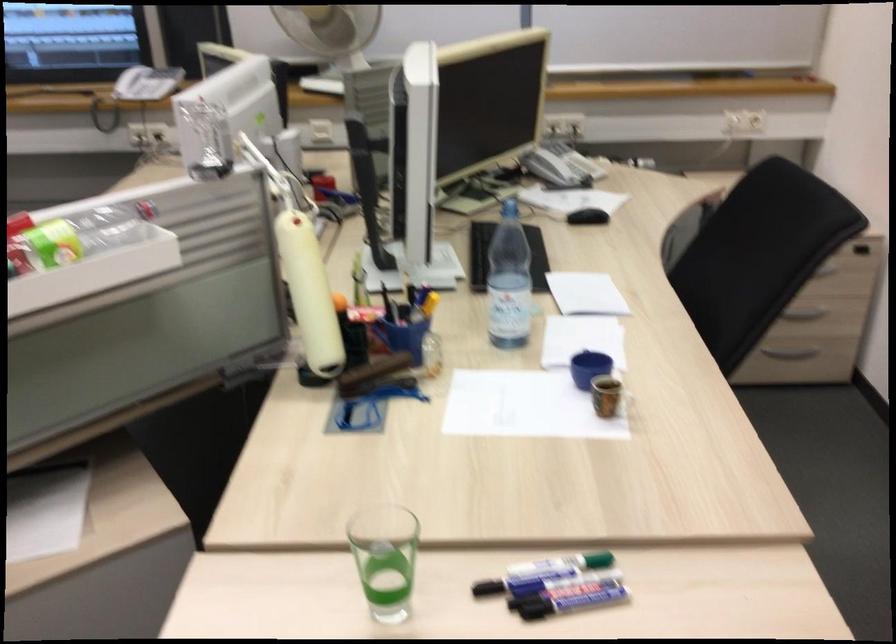
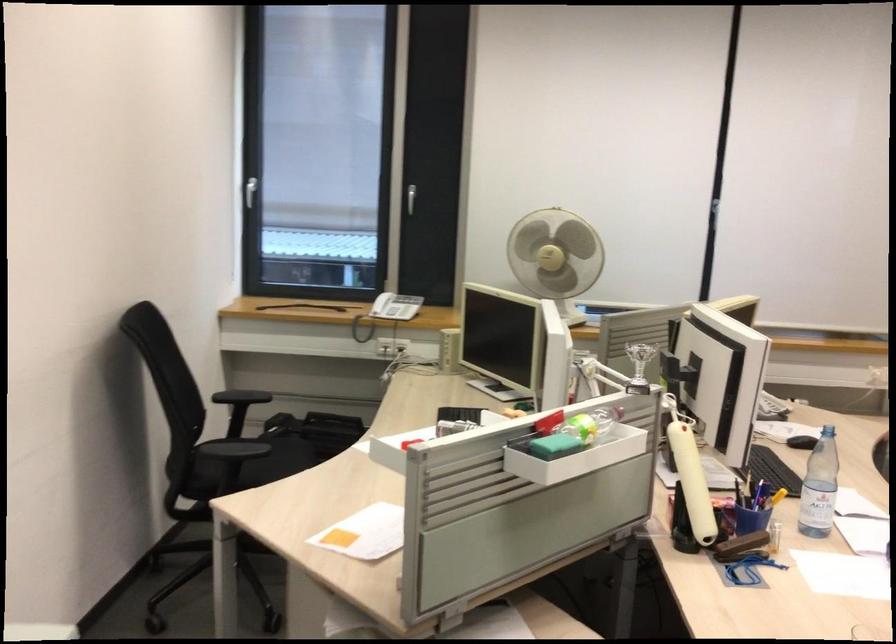
Find the pixel in the second image that matches point (409, 321) in the first image.

(752, 507)